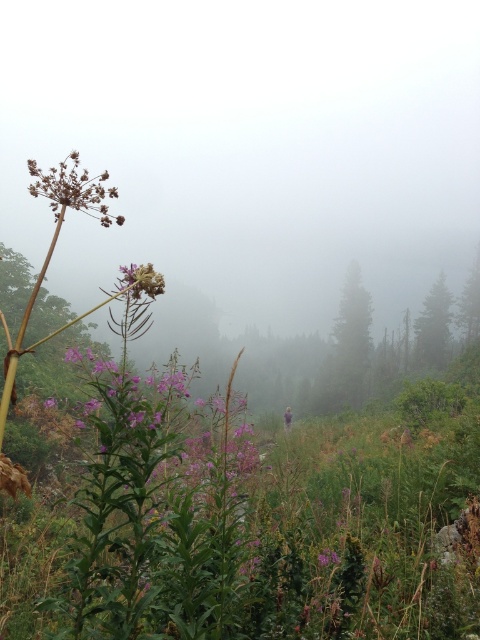
You are an artist planning to paint this landscape. You want to ensure the green matte tree at center and the purple matte flower at upper left are proportionally accurate. Which object should you paint larger?

The green matte tree at center should be painted larger than the purple matte flower at upper left because it is bigger in the scene.

You are an artist setting up an easel to paint the scene. You want to capture the brown textured flower at upper left without the green matte tree at center blocking it. Is this possible from your current position?

The brown textured flower at upper left is behind the green matte tree at center, so it is currently blocked by the tree. To paint the flower without obstruction, you would need to reposition yourself to a viewpoint where the tree is not between you and the flower.

You are standing at point A, which is at the bottom of the image. You want to walk to the green matte tree at right located at point B, which is at point (432, 326). What direction should you head to reach the green matte tree at right?

You should head towards the right direction from your current position at point A to reach the green matte tree at right located at point B.